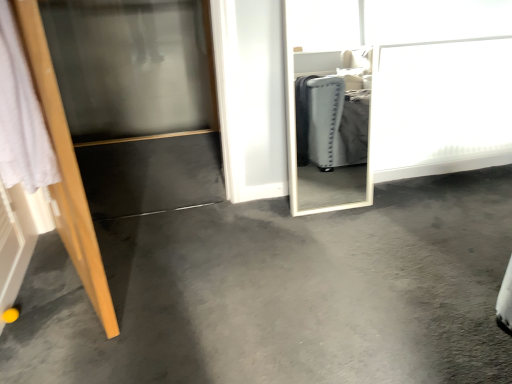
Where is `vacant area that is in front of wooden door at left`? vacant area that is in front of wooden door at left is located at coordinates (66, 331).